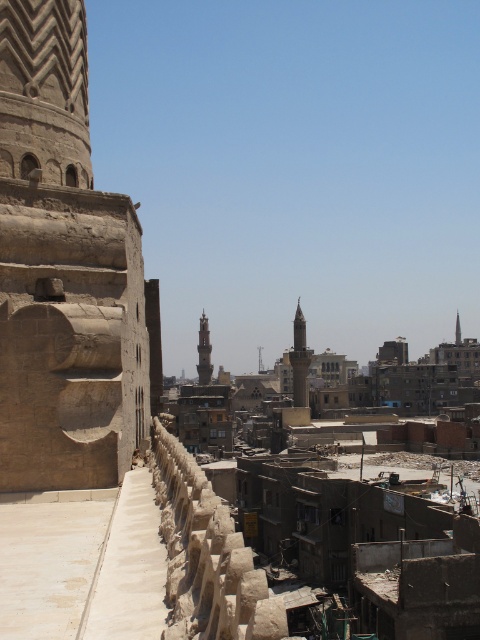
Between light brown stone minaret at center and brown stone tower at center, which one is positioned lower?

brown stone tower at center

Which is behind, point (300, 392) or point (204, 348)?

Point (204, 348)

This screenshot has height=640, width=480. Identify the location of light brown stone minaret at center. (300, 360).

Is light brown stone minaret at center further to the viewer compared to smooth stone minaret at center?

That is False.

Who is more distant from viewer, (294, 401) or (457, 339)?

Point (457, 339)

Image resolution: width=480 pixels, height=640 pixels. In order to click on light brown stone minaret at center in this screenshot , I will do `click(300, 360)`.

Can you confirm if brown stone tower at center is positioned to the left of smooth stone minaret at center?

Correct, you'll find brown stone tower at center to the left of smooth stone minaret at center.

Who is more distant from viewer, (204, 365) or (460, 339)?

Positioned behind is point (460, 339).

Find the location of a particular element. brown stone tower at center is located at coordinates (204, 353).

At what (x,y) coordinates should I click in order to perform the action: click on brown stone tower at center. Please return your answer as a coordinate pair (x, y). The image size is (480, 640). Looking at the image, I should click on (204, 353).